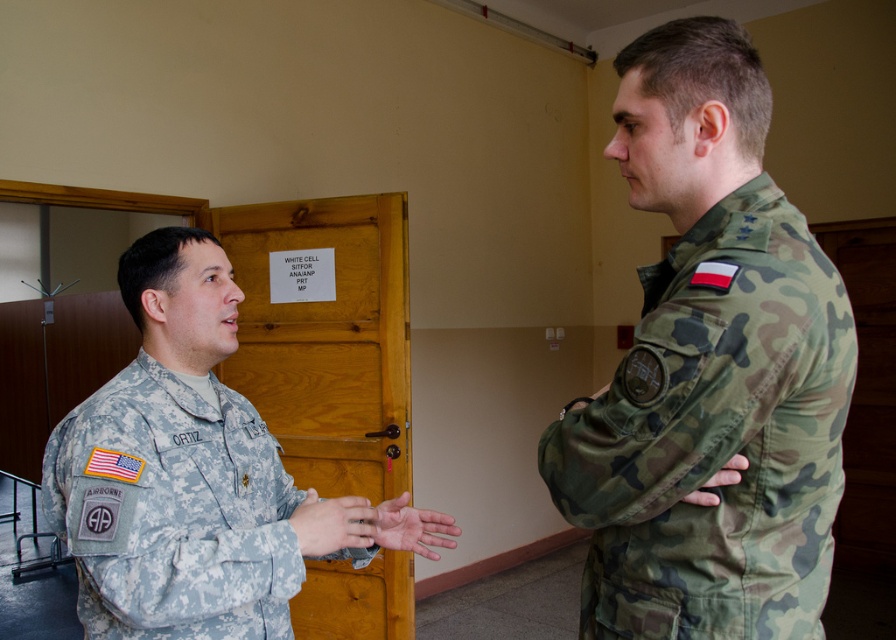
Is matte military uniform at center to the right of camouflage fabric hand at center from the viewer's perspective?

Incorrect, matte military uniform at center is not on the right side of camouflage fabric hand at center.

Measure the distance between matte military uniform at center and camera.

matte military uniform at center and camera are 1.07 meters apart.

At what (x,y) coordinates should I click in order to perform the action: click on matte military uniform at center. Please return your answer as a coordinate pair (x, y). This screenshot has height=640, width=896. Looking at the image, I should click on (333, 524).

You are a GUI agent. You are given a task and a screenshot of the screen. Output one action in this format:
    pyautogui.click(x=<x>, y=<y>)
    Task: Click on the matte military uniform at center
    The width and height of the screenshot is (896, 640).
    Given the screenshot: What is the action you would take?
    pyautogui.click(x=333, y=524)

Between point (104, 557) and point (300, 531), which one is positioned in front?

Positioned in front is point (104, 557).

Which of these two, camouflage uniform at center or matte military uniform at center, stands shorter?

matte military uniform at center is shorter.

The image size is (896, 640). What are the coordinates of `camouflage uniform at center` in the screenshot? It's located at (175, 468).

This screenshot has width=896, height=640. Describe the element at coordinates (412, 528) in the screenshot. I see `smooth skin hand at center` at that location.

In the scene shown: Can you confirm if smooth skin hand at center is positioned below camouflage fabric hand at center?

Yes, smooth skin hand at center is below camouflage fabric hand at center.

Is point (412, 524) positioned in front of point (724, 484)?

No.

Where is `smooth skin hand at center`? The width and height of the screenshot is (896, 640). smooth skin hand at center is located at coordinates (412, 528).